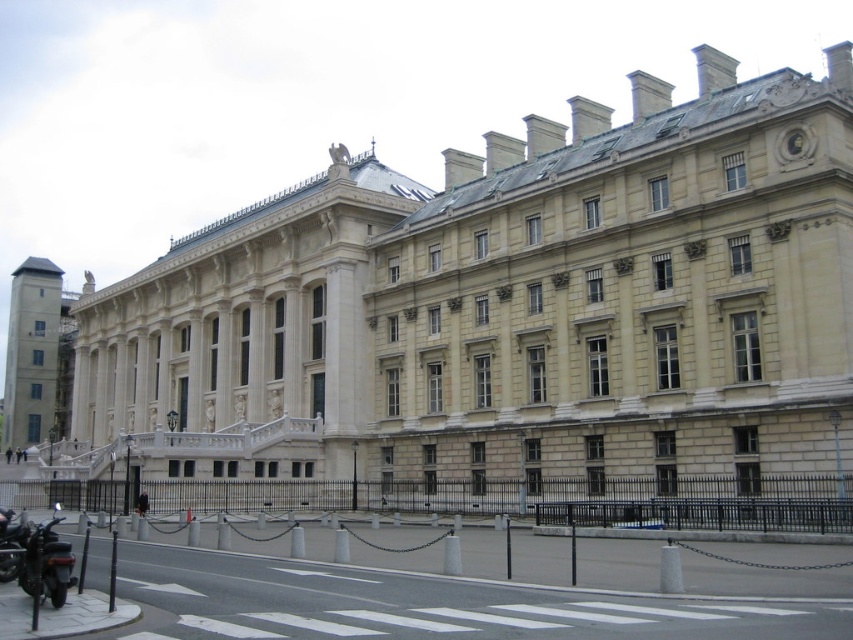
You are standing in front of a beige stone palace at center. If you want to take a photo of the entire building without any part being cut off, what should you consider about your current position?

You need to move back because the beige stone palace at center is 47.63 meters away from your current position, which might be too far to capture the entire building in one frame without zooming or using a wide angle lens.

Based on the photo, you are standing in front of the beige stone palace at center and want to take a photo of the shiny black motorbike at lower left. Since the palace is between you and the motorbike, will you be able to see the motorbike in your photo if you frame the palace in the center?

The beige stone palace at center is further to the viewer than the shiny black motorbike at lower left, so if you are standing in front of the palace, the motorbike is behind the palace and would not be visible in the photo.

You are standing in front of the grand classical building and want to take a photo. You notice two points marked in the scene. The first point is at coordinate point [662,472] and the second is at point [21,556]. Which point is closer to your camera position?

Point [662,472] is further to the camera than point [21,556], so the point closer to the camera is point [21,556].